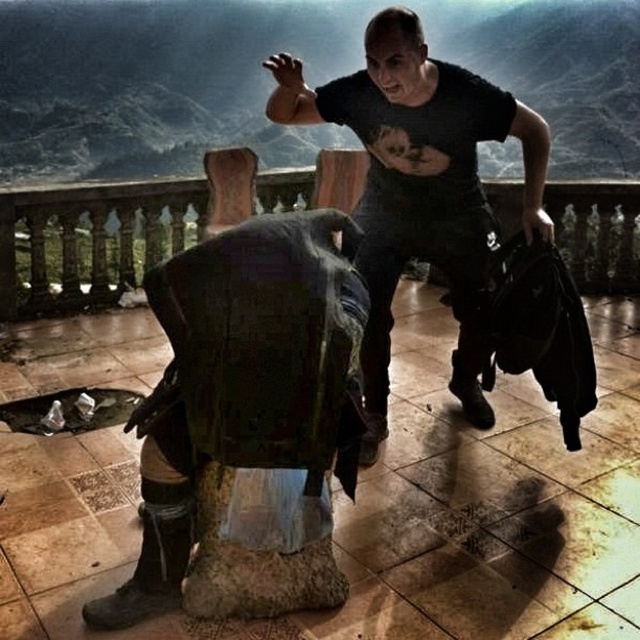
You are standing on the balcony and want to move from the brushed metal railing at upper center to the polished stone balustrade at center. Which direction should you move in to reach it?

The polished stone balustrade at center is behind the brushed metal railing at upper center, so you should move backward to reach it.